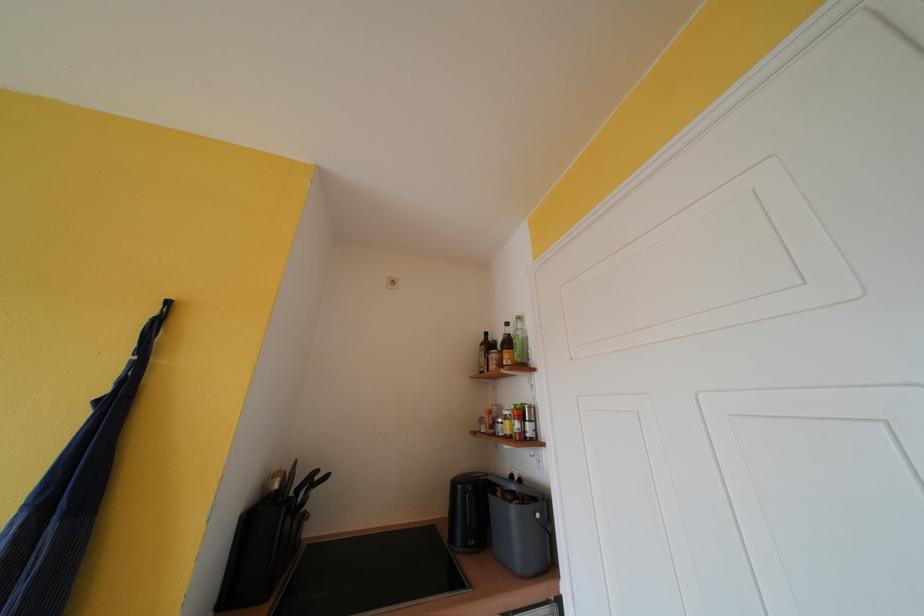
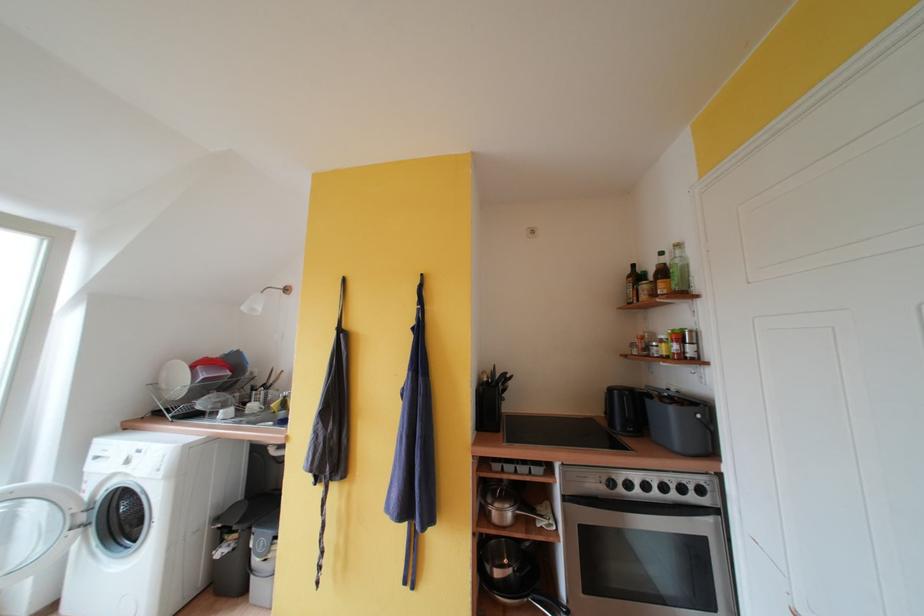
Find the pixel in the second image that matches point (518, 513) in the first image.

(678, 413)